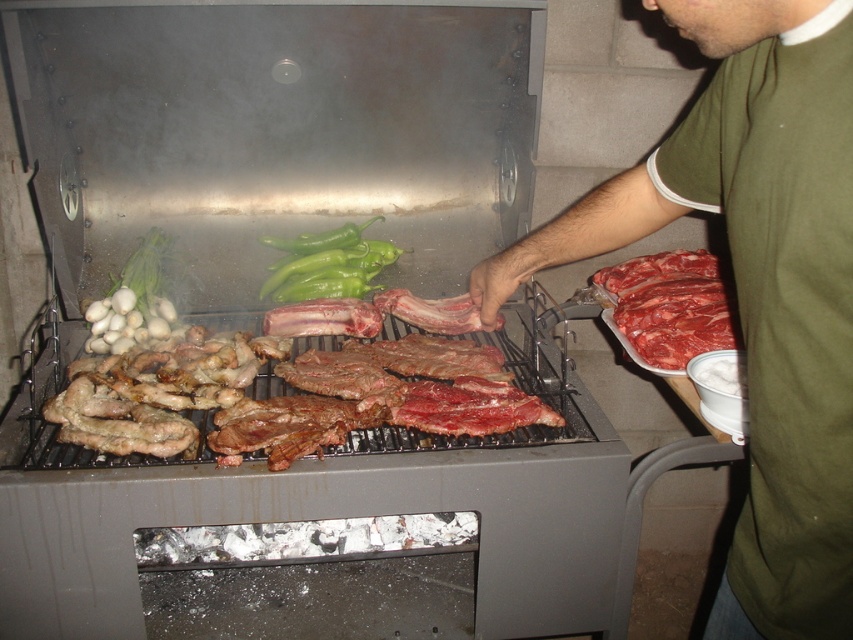
Question: Is green glossy peppers at center smaller than green matte onion at upper left?

Choices:
 (A) yes
 (B) no

Answer: (B)

Question: Which is farther from the raw red meat at right?

Choices:
 (A) green glossy peppers at center
 (B) stainless steel grill at center

Answer: (A)

Question: Does raw red meat at right appear over green matte onion at upper left?

Choices:
 (A) yes
 (B) no

Answer: (B)

Question: Which point is closer to the camera?

Choices:
 (A) (813, 51)
 (B) (378, 253)
 (C) (692, 282)
 (D) (187, 122)

Answer: (A)

Question: Considering the real-world distances, which object is closest to the green cotton shirt at upper right?

Choices:
 (A) stainless steel grill at center
 (B) raw red meat at right

Answer: (A)

Question: From the image, what is the correct spatial relationship of green cotton shirt at upper right in relation to green glossy peppers at center?

Choices:
 (A) above
 (B) below

Answer: (B)